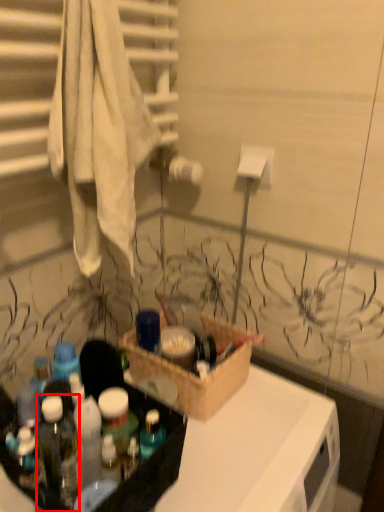
Question: Considering the relative positions of bottle (annotated by the red box) and box in the image provided, where is bottle (annotated by the red box) located with respect to the staircase?

Choices:
 (A) right
 (B) left

Answer: (B)